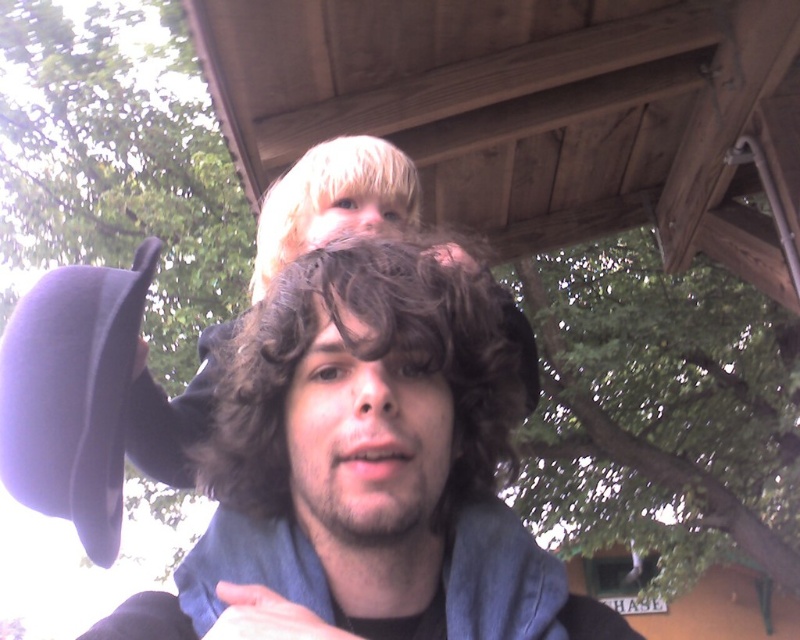
Question: Which point appears farthest from the camera in this image?

Choices:
 (A) (336, 204)
 (B) (385, 308)
 (C) (14, 477)

Answer: (A)

Question: Does curly brown hair at center appear over blondehair texture at upper center?

Choices:
 (A) no
 (B) yes

Answer: (A)

Question: Is curly brown hair at center wider than blondehair texture at upper center?

Choices:
 (A) no
 (B) yes

Answer: (B)

Question: Which object is closer to the camera taking this photo?

Choices:
 (A) curly brown hair at center
 (B) blondehair texture at upper center

Answer: (A)

Question: Estimate the real-world distances between objects in this image. Which object is farther from the curly brown hair at center?

Choices:
 (A) matte purple hat at left
 (B) blondehair texture at upper center

Answer: (B)

Question: Does curly brown hair at center have a smaller size compared to matte purple hat at left?

Choices:
 (A) no
 (B) yes

Answer: (A)